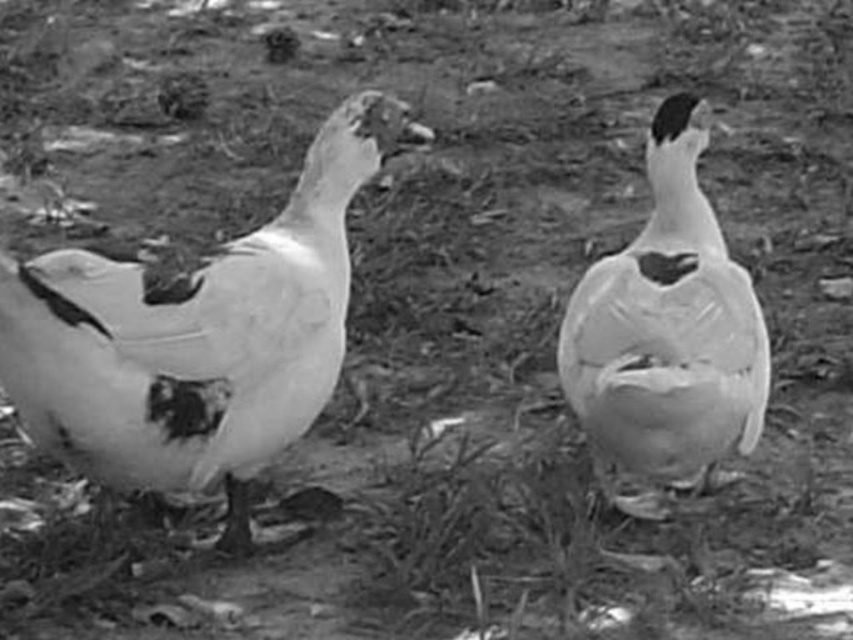
You are a farmer observing the two birds in the scene. Which bird is taller between the white matte goose at left and the white matte duck at center?

The white matte goose at left is taller than the white matte duck at center.

You are a wildlife photographer aiming to capture both the white matte goose at left and another duck in the scene. Given their positions, which direction should you adjust your camera to focus on the other duck?

The white matte goose at left is located at point [195,337], so to focus on the other duck, you should adjust your camera to the right since the other duck is positioned to the right of the white matte goose at left.

You are a photographer trying to capture both the white matte goose at left and the white matte duck at center in a single shot. Based on their positions, which one would appear closer to the camera in the photo?

The white matte goose at left is in front of the white matte duck at center, so it would appear closer to the camera in the photo.